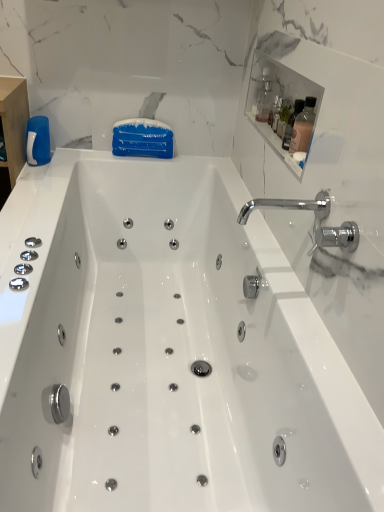
Question: Considering the positions of point (261, 96) and point (162, 276), is point (261, 96) closer or farther from the camera than point (162, 276)?

Choices:
 (A) farther
 (B) closer

Answer: (B)

Question: From a real-world perspective, relative to white glossy bathtub at center, is white glossy medicine cabinet at upper right vertically above or below?

Choices:
 (A) below
 (B) above

Answer: (B)

Question: Estimate the real-world distances between objects in this image. Which object is closer to the clear glass bottle at upper right, which ranks as the 2th bottle in front-to-back order?

Choices:
 (A) chrome/metallic faucet at upper right
 (B) white glossy medicine cabinet at upper right
 (C) blue glossy bottle at left
 (D) translucent pink bottle at upper right, acting as the 1th bottle starting from the front
 (E) white glossy bathtub at center

Answer: (B)

Question: Considering the real-world distances, which object is closest to the clear glass bottle at upper right, which ranks as the 2th bottle in front-to-back order?

Choices:
 (A) chrome/metallic faucet at upper right
 (B) white glossy bathtub at center
 (C) white glossy medicine cabinet at upper right
 (D) blue glossy bottle at left
 (E) translucent pink bottle at upper right, acting as the 1th bottle starting from the front

Answer: (C)